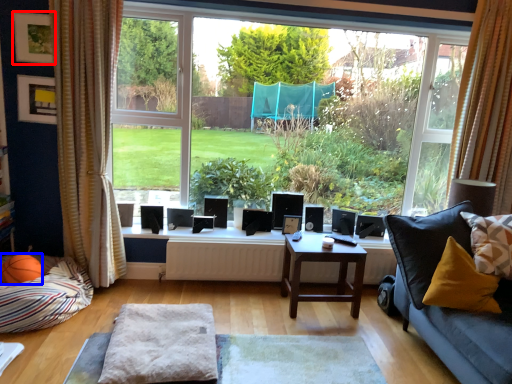
Question: Which object appears farthest to the camera in this image, picture frame (highlighted by a red box) or basketball (highlighted by a blue box)?

Choices:
 (A) picture frame
 (B) basketball

Answer: (A)